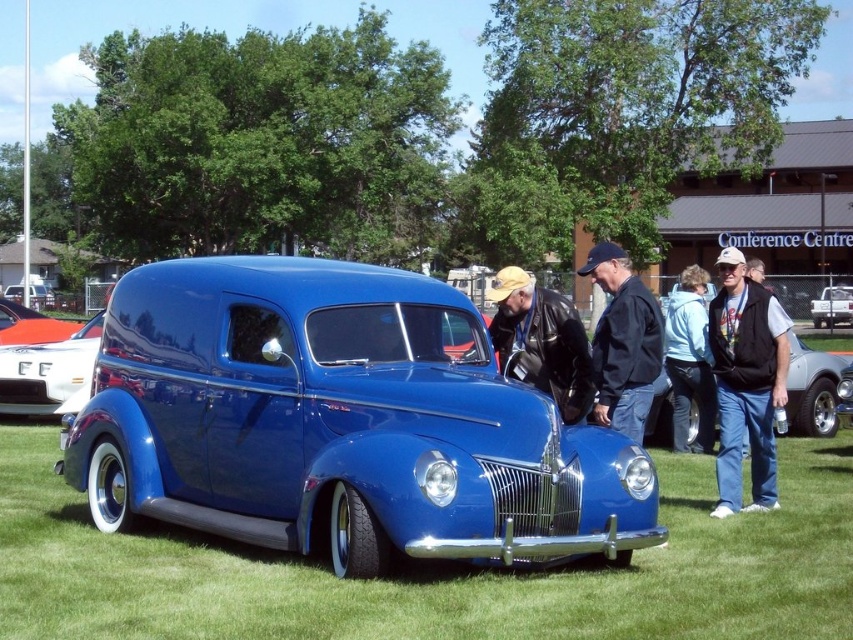
Question: Which is farther from the shiny blue van at center?

Choices:
 (A) matte blue van at center
 (B) black leather jacket at center
 (C) leather jacket at center
 (D) orange glossy car at center

Answer: (A)

Question: Is black leather jacket at center above matte blue van at center?

Choices:
 (A) yes
 (B) no

Answer: (B)

Question: Which object appears closest to the camera in this image?

Choices:
 (A) leather jacket at center
 (B) orange glossy car at center

Answer: (A)

Question: Can you confirm if green grass at center is thinner than black vest at right?

Choices:
 (A) no
 (B) yes

Answer: (B)

Question: Observing the image, what is the correct spatial positioning of green grass at center in reference to black leather jacket at center?

Choices:
 (A) left
 (B) right

Answer: (A)

Question: Estimate the real-world distances between objects in this image. Which object is farther from the shiny blue van at center?

Choices:
 (A) white glossy truck at center
 (B) black leather jacket at center

Answer: (A)